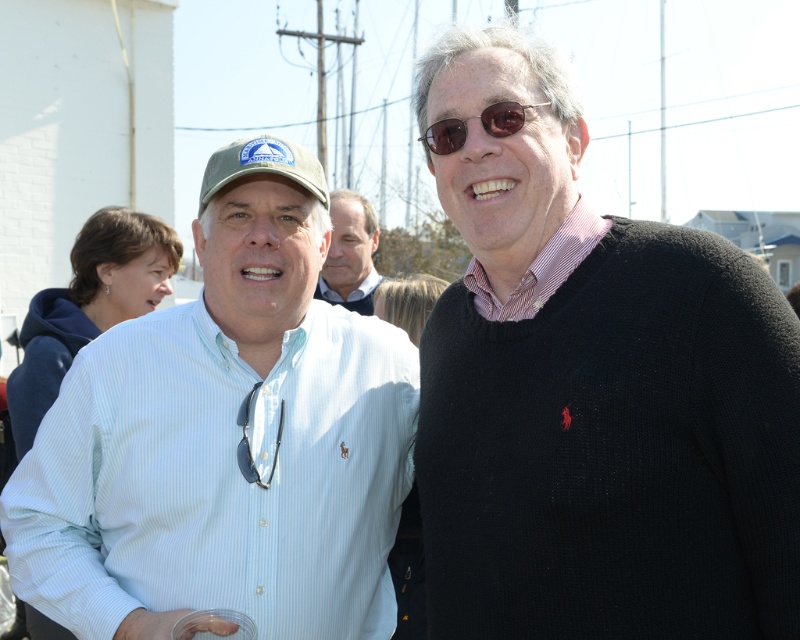
You are standing at the origin point in the image. The light blue shirt at center is represented by point (350, 253). Which direction should you move to reach the light blue shirt at center?

Since the light blue shirt at center is represented by point (350, 253), you should move towards the center of the image to reach it.

You are a photographer at the event and want to capture a photo of the matte blue shirt at center and the sunglasses at center. Which object is located to the left of the other?

The matte blue shirt at center is positioned on the left side of sunglasses at center, so the matte blue shirt at center is to the left of the sunglasses at center.

You are at the center of the image and want to find the light blue shirt at center. In which direction should you look to see it?

The light blue shirt at center is located at the center of the image, so you should look straight ahead to see it.